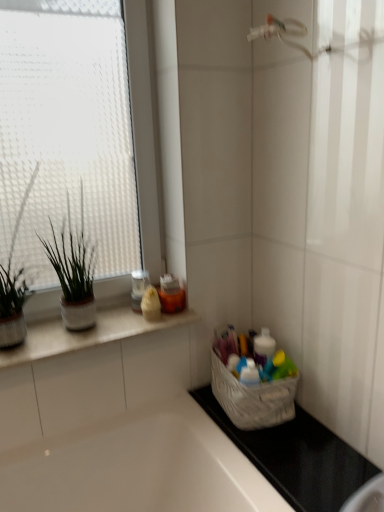
Locate an element on the screen. The height and width of the screenshot is (512, 384). empty space that is ontop of black rubber mat at lower right is located at coordinates (291, 447).